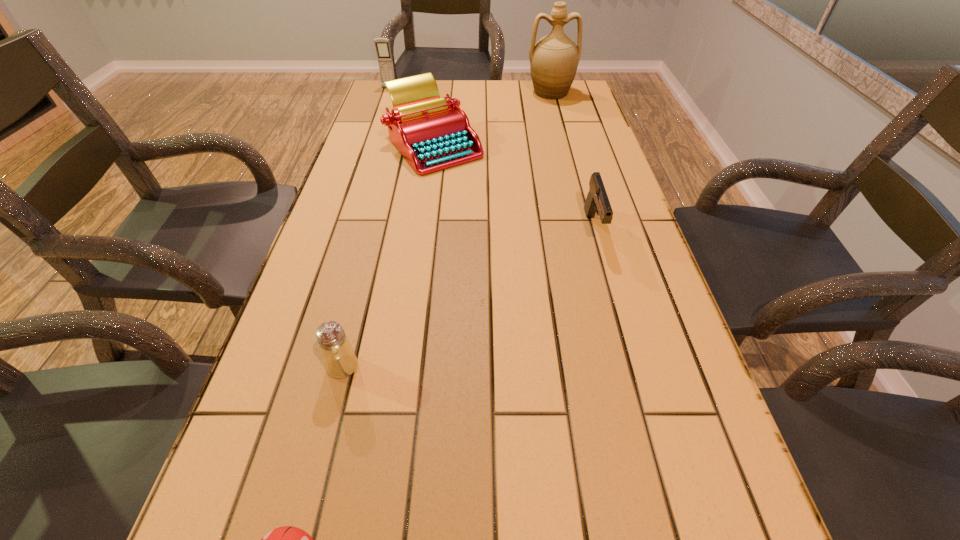
Identify the location of free space located on the back of the saltshaker. (375, 239).

I want to click on pitcher present at the far edge, so click(554, 59).

At what (x,y) coordinates should I click in order to perform the action: click on cellular telephone present at the far edge. Please return your answer as a coordinate pair (x, y). Looking at the image, I should click on (382, 45).

The width and height of the screenshot is (960, 540). Identify the location of cellular telephone that is positioned at the left edge. (382, 45).

The width and height of the screenshot is (960, 540). In order to click on typewriter situated at the left edge in this screenshot , I will do `click(432, 133)`.

Identify the location of saltshaker located in the left edge section of the desktop. (340, 361).

I want to click on pitcher that is at the right edge, so click(x=554, y=59).

Find the location of a particular element. pistol present at the right edge is located at coordinates (597, 202).

The width and height of the screenshot is (960, 540). I want to click on object that is at the far left corner, so click(x=382, y=45).

Identify the location of object at the far right corner. The image size is (960, 540). (554, 59).